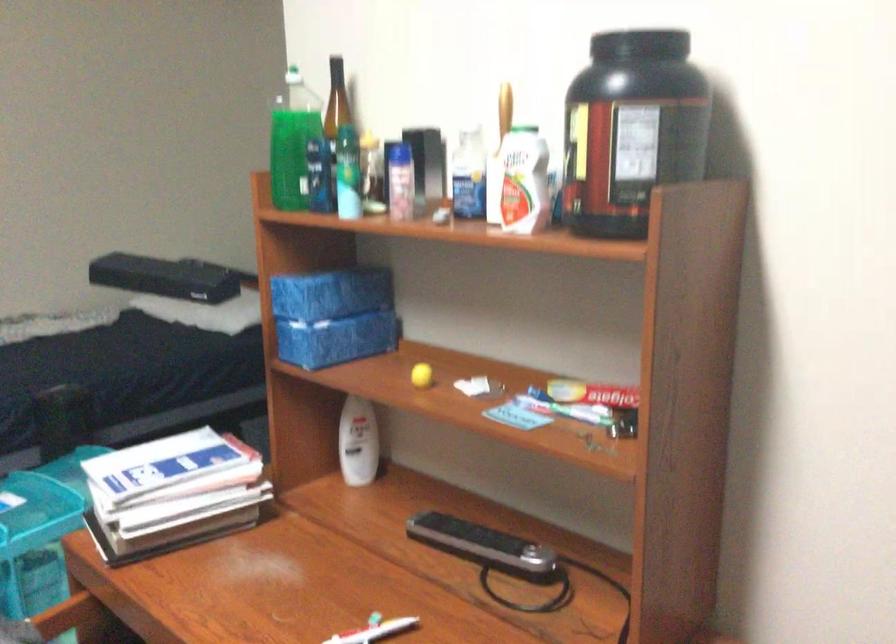
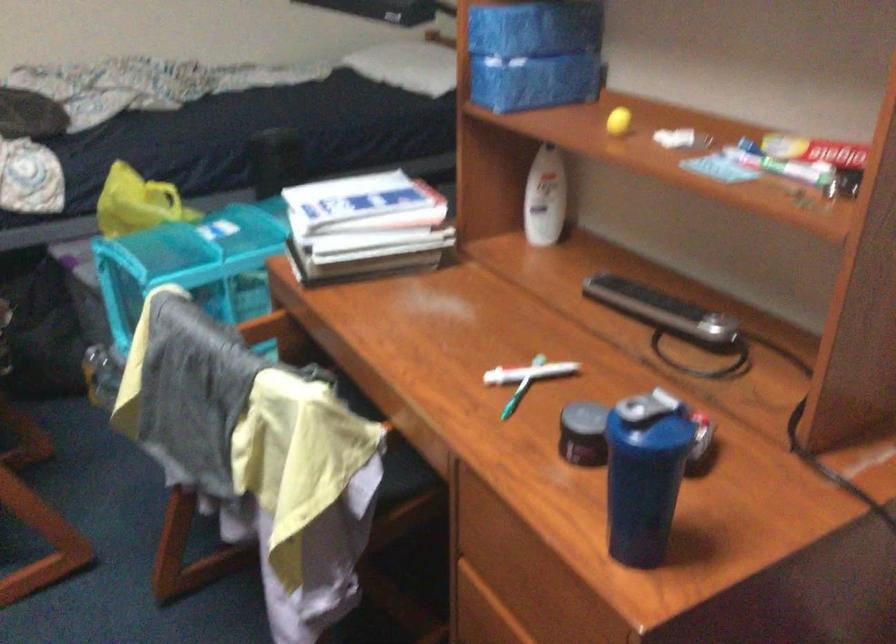
Locate, in the second image, the point that corresponds to (x=421, y=372) in the first image.

(617, 120)